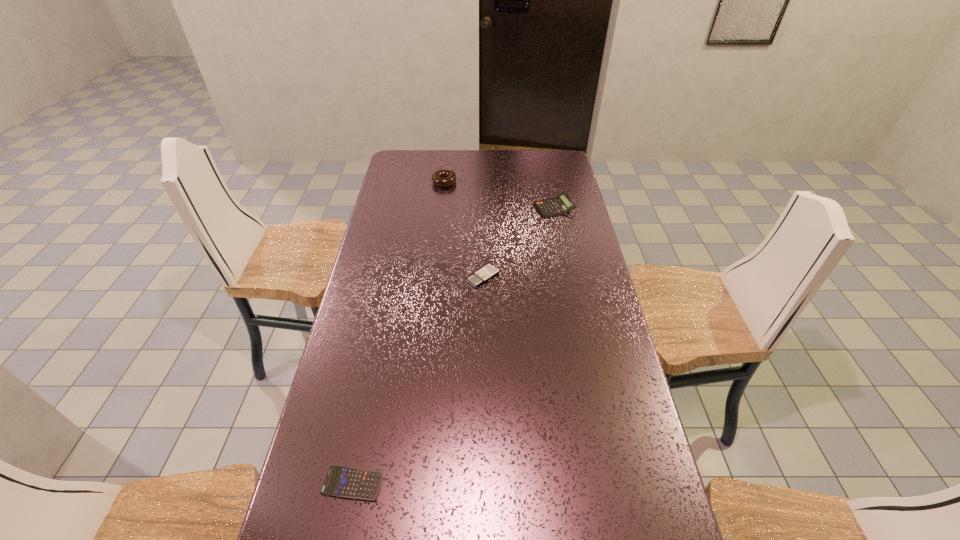
I want to click on the farthest object, so click(x=443, y=178).

Where is `the third object from right to left`? The width and height of the screenshot is (960, 540). the third object from right to left is located at coordinates (443, 178).

You are a GUI agent. You are given a task and a screenshot of the screen. Output one action in this format:
    pyautogui.click(x=<x>, y=<y>)
    Task: Click on the third nearest object
    
    Given the screenshot: What is the action you would take?
    pyautogui.click(x=561, y=204)

Where is `the rightmost calculator`? Image resolution: width=960 pixels, height=540 pixels. the rightmost calculator is located at coordinates (561, 204).

At what (x,y) coordinates should I click in order to perform the action: click on the second calculator from right to left. Please return your answer as a coordinate pair (x, y). Looking at the image, I should click on (487, 272).

You are a GUI agent. You are given a task and a screenshot of the screen. Output one action in this format:
    pyautogui.click(x=<x>, y=<y>)
    Task: Click on the second shortest object
    Image resolution: width=960 pixels, height=540 pixels.
    Given the screenshot: What is the action you would take?
    pyautogui.click(x=487, y=272)

Locate an element on the screen. This screenshot has height=540, width=960. the leftmost calculator is located at coordinates (340, 481).

This screenshot has height=540, width=960. I want to click on the nearest object, so click(340, 481).

Locate an element on the screen. The height and width of the screenshot is (540, 960). vacant region located 0.300m on the front of the second object from left to right is located at coordinates (439, 232).

You are a GUI agent. You are given a task and a screenshot of the screen. Output one action in this format:
    pyautogui.click(x=<x>, y=<y>)
    Task: Click on the vacant space situated on the left of the tallest calculator
    The image size is (960, 540).
    Given the screenshot: What is the action you would take?
    pyautogui.click(x=517, y=208)